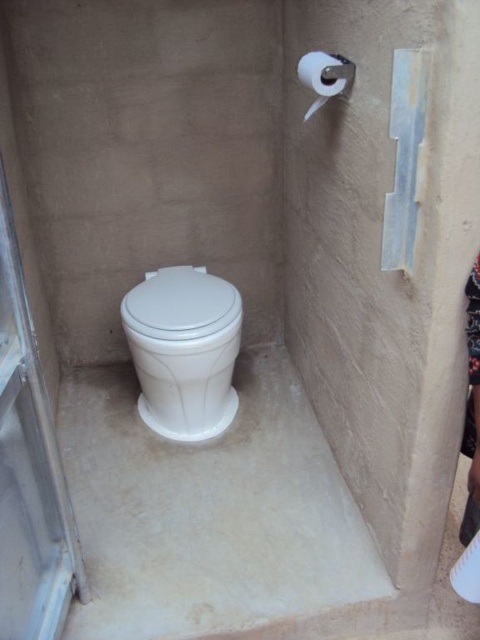
Can you confirm if clear plastic screen door at left is positioned to the right of white matte toilet paper at upper right?

Incorrect, clear plastic screen door at left is not on the right side of white matte toilet paper at upper right.

Which is more to the left, clear plastic screen door at left or white matte toilet paper at upper right?

clear plastic screen door at left

Image resolution: width=480 pixels, height=640 pixels. Find the location of `clear plastic screen door at left`. clear plastic screen door at left is located at coordinates (29, 472).

Does point (184, 339) lie in front of point (160, 304)?

That is True.

This screenshot has height=640, width=480. Describe the element at coordinates (183, 349) in the screenshot. I see `white glossy toilet at center` at that location.

Image resolution: width=480 pixels, height=640 pixels. What are the coordinates of `white glossy toilet at center` in the screenshot? It's located at click(x=183, y=349).

Where is `white glossy toilet at center`? The width and height of the screenshot is (480, 640). white glossy toilet at center is located at coordinates (183, 349).

Describe the element at coordinates (183, 349) in the screenshot. I see `white glossy toilet at center` at that location.

Does white glossy toilet at center have a greater height compared to white matte toilet paper at upper right?

Yes, white glossy toilet at center is taller than white matte toilet paper at upper right.

Which is behind, point (225, 326) or point (313, 74)?

The point (225, 326) is more distant.

This screenshot has width=480, height=640. Identify the location of white glossy toilet at center. (183, 349).